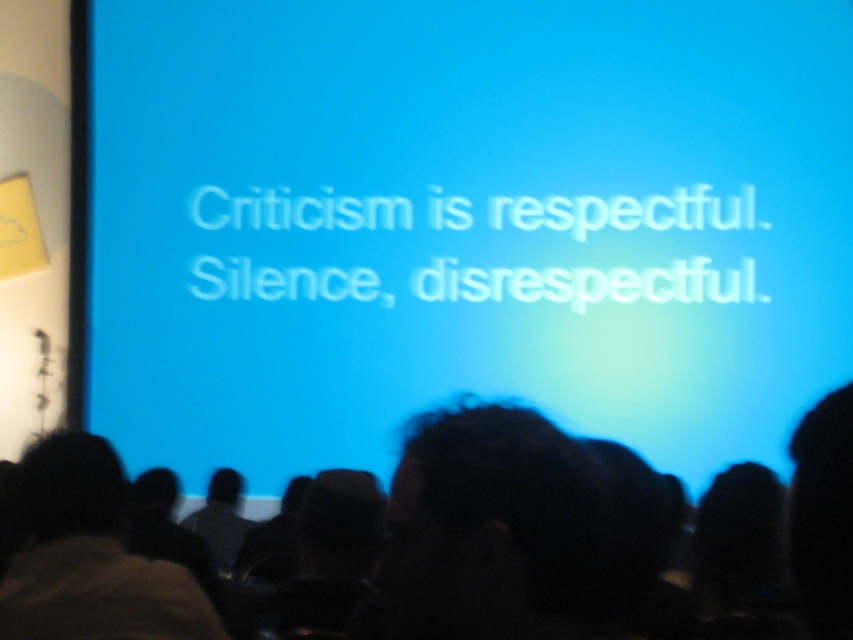
You are sitting in the audience and notice the blue matte screen at center and the dark hair at center. Which object is positioned to the left from your viewpoint?

The blue matte screen at center is positioned to the left of the dark hair at center from your viewpoint.

You are sitting in the front row of the audience and notice a person with dark hair at center. Based on the coordinates provided in the description, can you estimate where this person is sitting relative to the screen?

The dark hair at center is located at point coordinates approximately 0.806 on the x axis and 0.966 on the y axis. Since the coordinate system likely places the origin at the bottom left corner, this position would place the person sitting near the lower right side of the screen. However, since this is a silhouette in the foreground, the person with dark hair at center is actually seated in the front row, directly facing the screen.